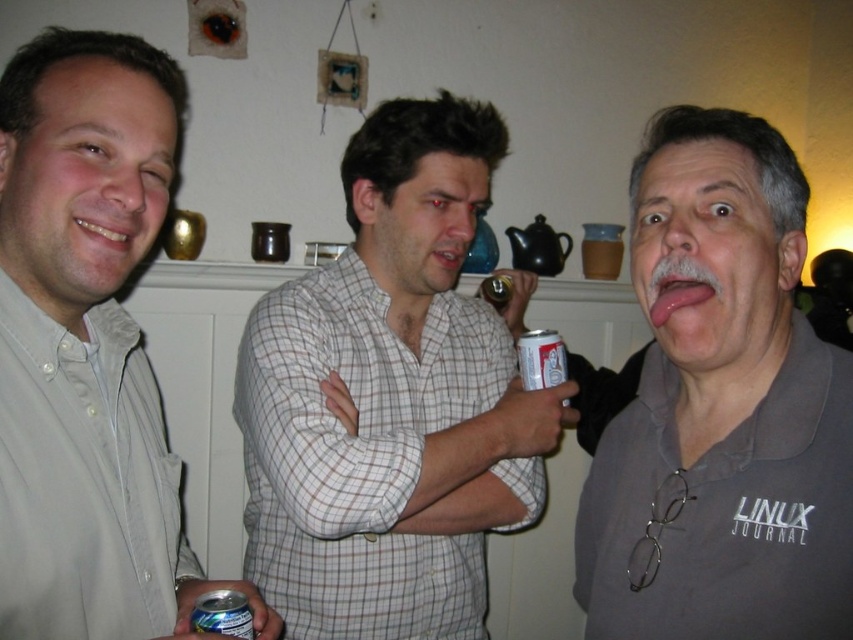
You are standing at the point labeled point (x=840, y=372) and want to move to the point labeled point (x=352, y=598). Which direction should you move in relation to the other point?

You should move towards the point labeled point (x=352, y=598), which is behind the point labeled point (x=840, y=372) according to the spatial relationship provided.